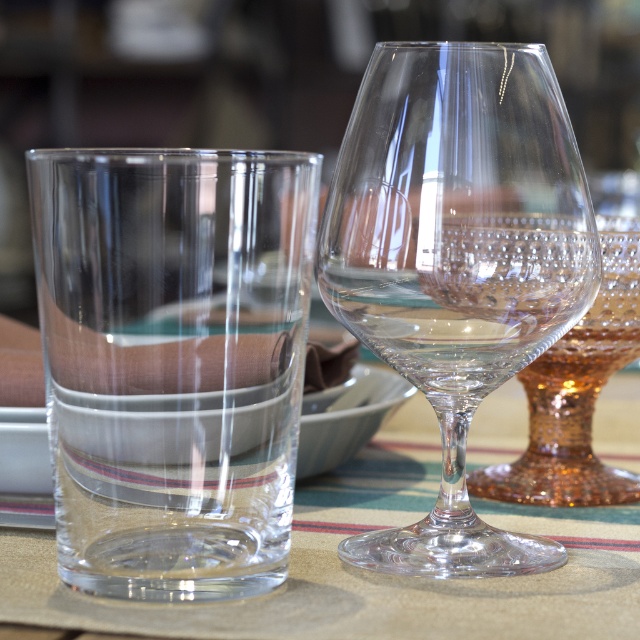
Question: Does transparent glass at left have a greater width compared to clear fabric placemat at center?

Choices:
 (A) no
 (B) yes

Answer: (A)

Question: Which point is farther from the camera taking this photo?

Choices:
 (A) (454, 417)
 (B) (205, 180)

Answer: (A)

Question: Is transparent glass at left to the right of clear crystal wine glass at center from the viewer's perspective?

Choices:
 (A) no
 (B) yes

Answer: (A)

Question: Which object is the closest to the clear crystal wine glass at center?

Choices:
 (A) transparent glass at left
 (B) clear fabric placemat at center

Answer: (A)

Question: Among these points, which one is farthest from the camera?

Choices:
 (A) (560, 186)
 (B) (524, 428)

Answer: (B)

Question: Is transparent glass at left closer to camera compared to clear fabric placemat at center?

Choices:
 (A) no
 (B) yes

Answer: (B)